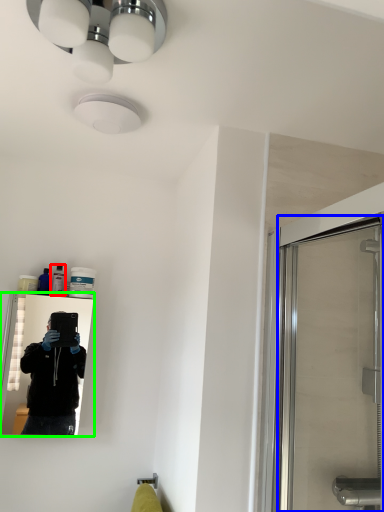
Question: Which object is positioned closest to toiletry (highlighted by a red box)? Select from screen door (highlighted by a blue box) and mirror (highlighted by a green box).

Choices:
 (A) screen door
 (B) mirror

Answer: (A)